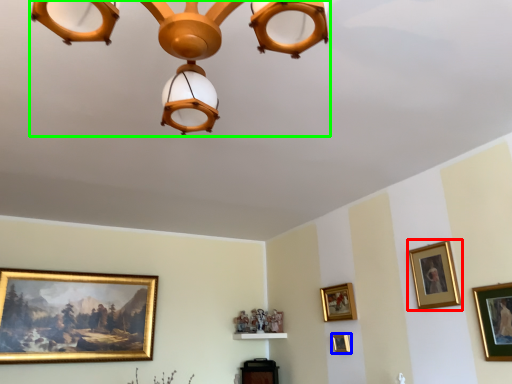
Question: Which is farther away from picture frame (highlighted by a red box)? picture frame (highlighted by a blue box) or lamp (highlighted by a green box)?

Choices:
 (A) picture frame
 (B) lamp

Answer: (B)